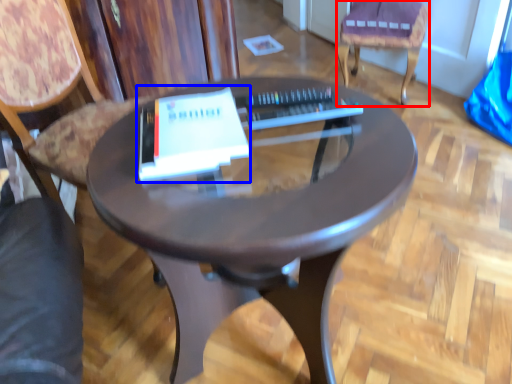
Question: Which point is further to the camera, chair (highlighted by a red box) or paperback book (highlighted by a blue box)?

Choices:
 (A) chair
 (B) paperback book

Answer: (A)